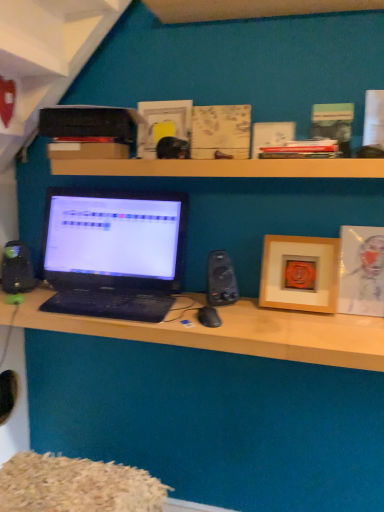
Question: Are black textured keyboard at center and black matte mouse at center far apart?

Choices:
 (A) yes
 (B) no

Answer: (B)

Question: Does black textured keyboard at center contain black matte mouse at center?

Choices:
 (A) yes
 (B) no

Answer: (B)

Question: Is black textured keyboard at center wider than black matte mouse at center?

Choices:
 (A) no
 (B) yes

Answer: (B)

Question: Can you confirm if black textured keyboard at center is bigger than black matte mouse at center?

Choices:
 (A) yes
 (B) no

Answer: (A)

Question: Is black textured keyboard at center outside of black matte mouse at center?

Choices:
 (A) yes
 (B) no

Answer: (A)

Question: Does black textured keyboard at center come behind black matte mouse at center?

Choices:
 (A) no
 (B) yes

Answer: (B)

Question: Considering the relative positions of matte black laptop at center and wooden picture frame at right, which is the 1th picture frame in left-to-right order, in the image provided, is matte black laptop at center to the left of wooden picture frame at right, which is the 1th picture frame in left-to-right order, from the viewer's perspective?

Choices:
 (A) no
 (B) yes

Answer: (B)

Question: Would you say matte black laptop at center is outside wooden picture frame at right, which is the 1th picture frame in left-to-right order?

Choices:
 (A) yes
 (B) no

Answer: (A)

Question: From a real-world perspective, is matte black laptop at center beneath wooden picture frame at right, which is the 1th picture frame in left-to-right order?

Choices:
 (A) no
 (B) yes

Answer: (B)

Question: Does matte black laptop at center lie in front of wooden picture frame at right, which is the 1th picture frame in left-to-right order?

Choices:
 (A) no
 (B) yes

Answer: (B)

Question: Considering the relative sizes of matte black laptop at center and wooden picture frame at right, marked as the second picture frame in a right-to-left arrangement, in the image provided, is matte black laptop at center thinner than wooden picture frame at right, marked as the second picture frame in a right-to-left arrangement,?

Choices:
 (A) no
 (B) yes

Answer: (A)

Question: Does matte black laptop at center have a greater height compared to wooden picture frame at right, marked as the second picture frame in a right-to-left arrangement?

Choices:
 (A) no
 (B) yes

Answer: (A)

Question: Is black plastic speaker at center-right, the second speaker in the left-to-right sequence, at the right side of black plastic speaker at left, which appears as the 2th speaker when viewed from the right?

Choices:
 (A) yes
 (B) no

Answer: (A)